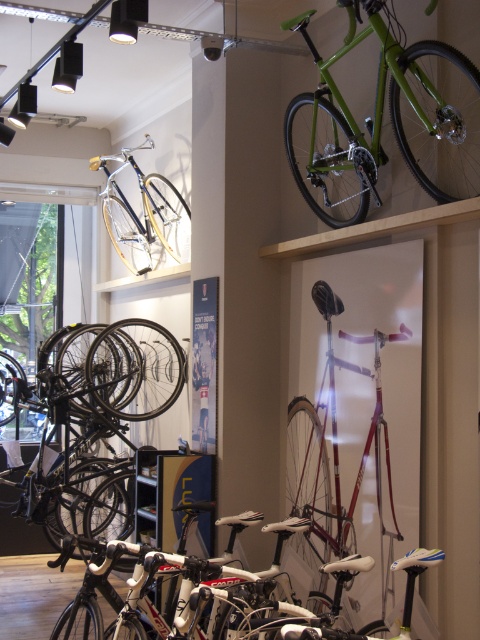
Question: Which point is closer to the camera?

Choices:
 (A) (91, 364)
 (B) (381, 486)

Answer: (B)

Question: Does shiny purple bicycle at center have a greater width compared to shiny silver bicycle at upper center?

Choices:
 (A) yes
 (B) no

Answer: (B)

Question: Is green matte bicycle at upper right to the right of shiny purple bicycle at center from the viewer's perspective?

Choices:
 (A) no
 (B) yes

Answer: (B)

Question: Does green matte bicycle at upper right have a larger size compared to shiny purple bicycle at center?

Choices:
 (A) yes
 (B) no

Answer: (A)

Question: Which point is closer to the camera?

Choices:
 (A) (305, 29)
 (B) (345, 513)
 (C) (2, 394)
 (D) (139, 173)

Answer: (B)

Question: Considering the real-world distances, which object is closest to the shiny black bike at lower left?

Choices:
 (A) shiny purple bicycle at center
 (B) green matte bicycle at upper right

Answer: (A)